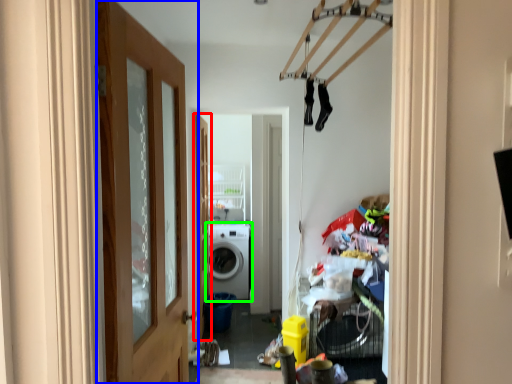
Question: Considering the real-world distances, which object is closest to door (highlighted by a red box)? door (highlighted by a blue box) or washing machine (highlighted by a green box).

Choices:
 (A) door
 (B) washing machine

Answer: (B)